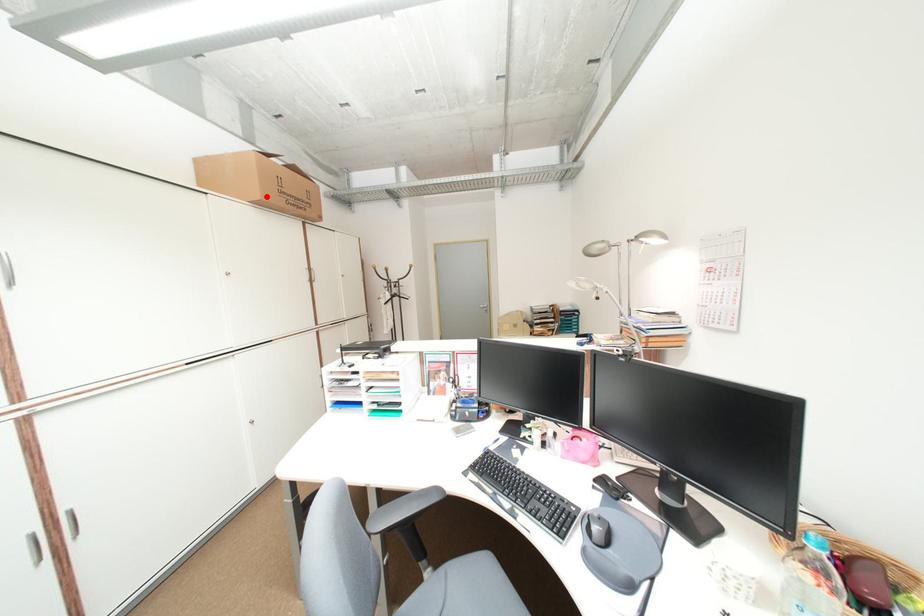
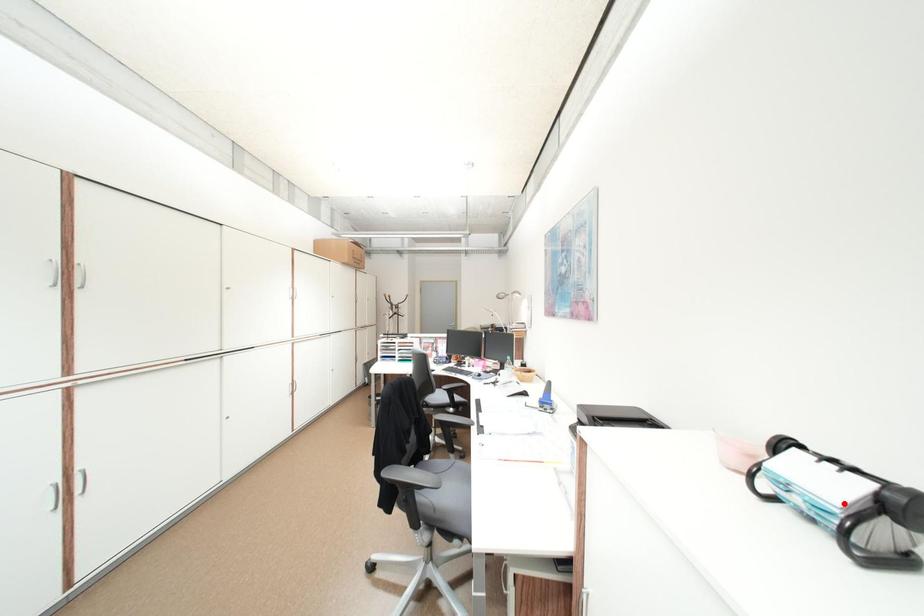
I am providing you with two images of the same scene from different viewpoints. A red point is marked on the first image and another point is marked on the second image. Does the point marked in image1 correspond to the same location as the one in image2?

No